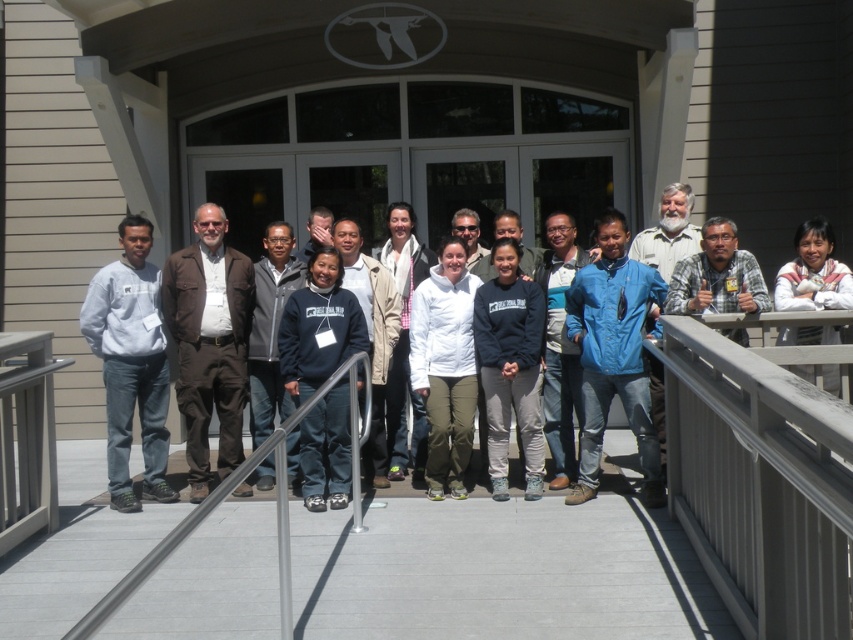
Looking at this image, you are a photographer trying to capture a clear photo of the matte brown jacket at center. However, there is a silver metallic handrail at center in the way. Can you adjust your position to avoid the handrail while still keeping the jacket in the frame?

The silver metallic handrail at center is in front of the matte brown jacket at center, so you can move your position slightly to the side or angle your camera to capture the jacket without the handrail blocking it.